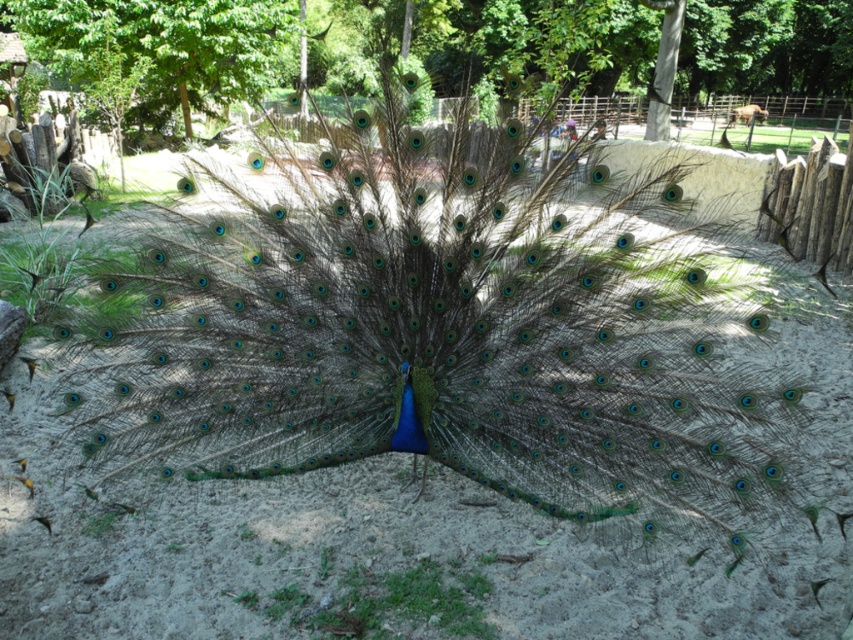
Can you confirm if green leafy tree at center is positioned to the right of green leafy tree at upper center?

Correct, you'll find green leafy tree at center to the right of green leafy tree at upper center.

I want to click on green leafy tree at center, so click(x=161, y=42).

Which is in front, point (39, 58) or point (196, 32)?

Positioned in front is point (196, 32).

Where is `green leafy tree at center`? green leafy tree at center is located at coordinates (161, 42).